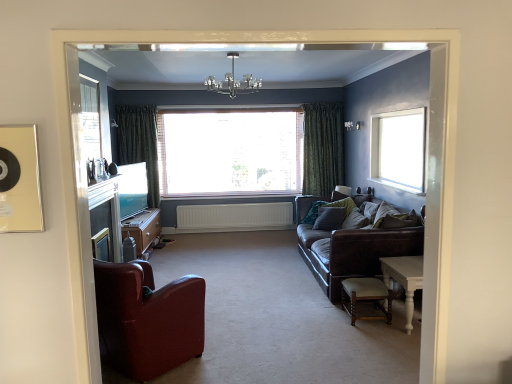
What are the coordinates of `vacant space situated on the left part of white wood table at lower right` in the screenshot? It's located at (358, 332).